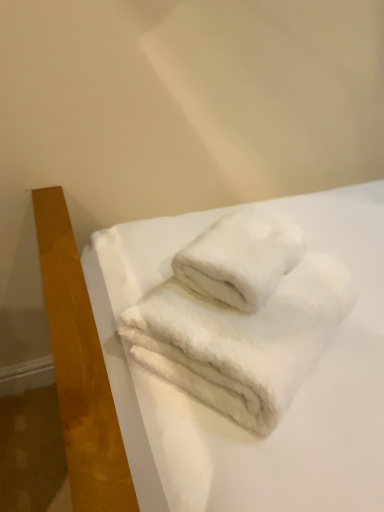
Question: Looking at their shapes, would you say white fluffy sheet at center is wider or thinner than white fluffy towel at center?

Choices:
 (A) wide
 (B) thin

Answer: (A)

Question: From a real-world perspective, relative to white fluffy towel at center, is white fluffy sheet at center vertically above or below?

Choices:
 (A) below
 (B) above

Answer: (A)

Question: In the image, is white fluffy sheet at center on the left side or the right side of white fluffy towel at center?

Choices:
 (A) left
 (B) right

Answer: (B)

Question: Looking at the image, does white fluffy towel at center seem bigger or smaller compared to white fluffy sheet at center?

Choices:
 (A) big
 (B) small

Answer: (B)

Question: From the image's perspective, is white fluffy towel at center located above or below white fluffy sheet at center?

Choices:
 (A) above
 (B) below

Answer: (A)

Question: Looking at their shapes, would you say white fluffy towel at center is wider or thinner than white fluffy sheet at center?

Choices:
 (A) thin
 (B) wide

Answer: (A)

Question: From their relative heights in the image, would you say white fluffy towel at center is taller or shorter than white fluffy sheet at center?

Choices:
 (A) short
 (B) tall

Answer: (A)